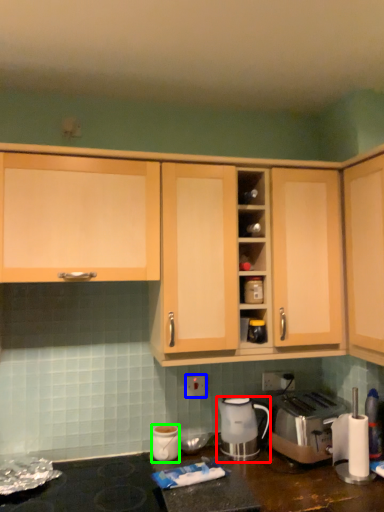
Question: Estimate the real-world distances between objects in this image. Which object is closer to home appliance (highlighted by a red box), electric outlet (highlighted by a blue box) or kitchen appliance (highlighted by a green box)?

Choices:
 (A) electric outlet
 (B) kitchen appliance

Answer: (A)